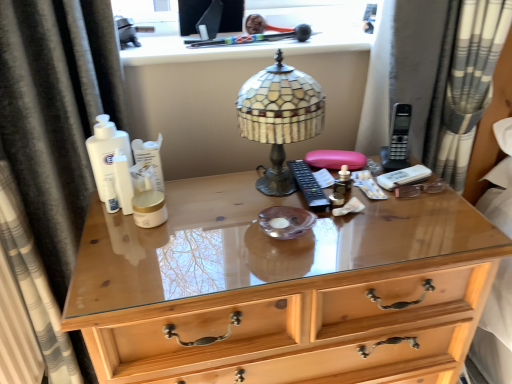
The image size is (512, 384). What are the coordinates of `vacant space in front of gold matte jar at center, acting as the 2th toiletry starting from the back` in the screenshot? It's located at (134, 301).